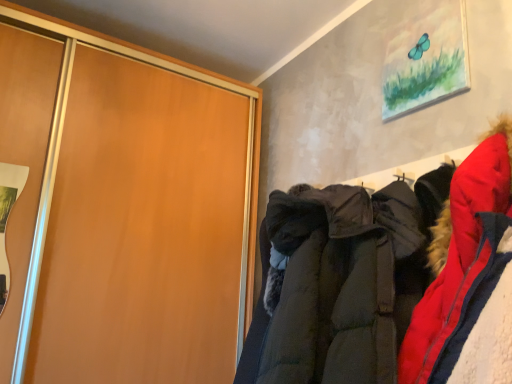
Question: In terms of size, does matte wood cupboard at left appear bigger or smaller than dark green quilted jacket at center?

Choices:
 (A) small
 (B) big

Answer: (B)

Question: Would you say matte wood cupboard at left is to the left or to the right of dark green quilted jacket at center in the picture?

Choices:
 (A) right
 (B) left

Answer: (B)

Question: Considering the positions of point (93, 91) and point (307, 274), is point (93, 91) closer or farther from the camera than point (307, 274)?

Choices:
 (A) closer
 (B) farther

Answer: (B)

Question: In terms of size, does dark green quilted jacket at center appear bigger or smaller than matte wood cupboard at left?

Choices:
 (A) small
 (B) big

Answer: (A)

Question: Is dark green quilted jacket at center inside the boundaries of matte wood cupboard at left, or outside?

Choices:
 (A) inside
 (B) outside

Answer: (B)

Question: Considering the positions of dark green quilted jacket at center and matte wood cupboard at left in the image, is dark green quilted jacket at center taller or shorter than matte wood cupboard at left?

Choices:
 (A) tall
 (B) short

Answer: (B)

Question: Looking at their shapes, would you say dark green quilted jacket at center is wider or thinner than matte wood cupboard at left?

Choices:
 (A) thin
 (B) wide

Answer: (B)